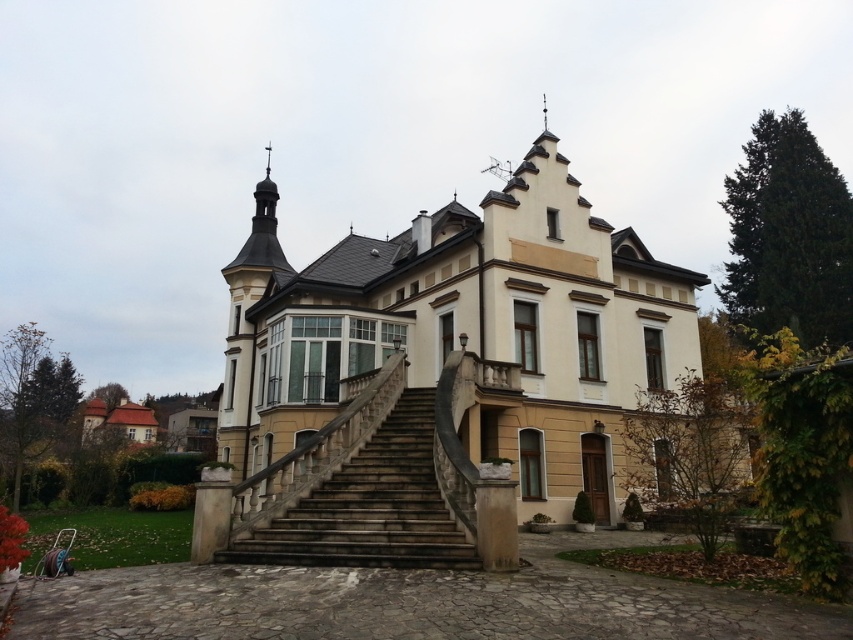
You are a drone operator tasked with capturing aerial footage of the beige stone mansion at center and the brown shingles at lower left. Since the drone has a limited flight altitude, you need to know which object is taller to avoid collision. Which one is taller?

The beige stone mansion at center is taller than the brown shingles at lower left, so you should adjust the drone to avoid collision with the beige stone mansion at center.

You are standing at the base of the brown stone staircase at center, facing the beige stone mansion at center. Which direction should you walk to move closer to the mansion?

Since the beige stone mansion at center is further to the viewer than the brown stone staircase at center, you are already closer to the mansion. To move even closer, you should walk forward towards the mansion.

You are standing at the base of the staircase in front of the villa. There are two points marked on the ground ahead of you. The first point is at coordinate point (245,506) and the second point is at coordinate point (97,408). If you walk straight towards the entrance door, which point will you step on first?

Point (97,408) will be stepped on first because point (245,506) is located behind it from your current position at the base of the staircase.